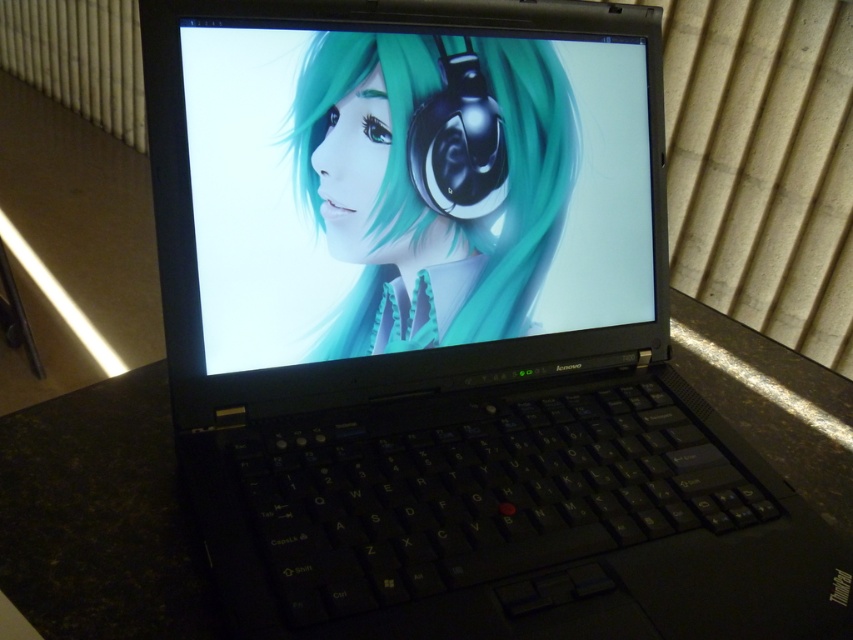
You are taking a photo of the Lenovo laptop and notice two points on its surface at coordinates point (496, 172) and point (498, 157). Which point is closer to the camera?

Point (496, 172) is further to the camera than point (498, 157), so the point closer to the camera is point (498, 157).

You have a small USB drive that is 1 inch long. You want to place it between the black matte table at center and the black glossy earphone at center. Is there enough space for the USB drive to fit in the gap between them?

The distance between the black matte table at center and the black glossy earphone at center is 13.24 inches. Since the USB drive is only 1 inch long, there is more than enough space to place it between them.

You are a tech support agent helping a customer who wants to place a small decorative item on their laptop. The customer mentions they have a matte black screen at center and a black glossy earphone at center. Which object would require more space due to its size?

The matte black screen at center is larger in size than the black glossy earphone at center, so it would require more space.